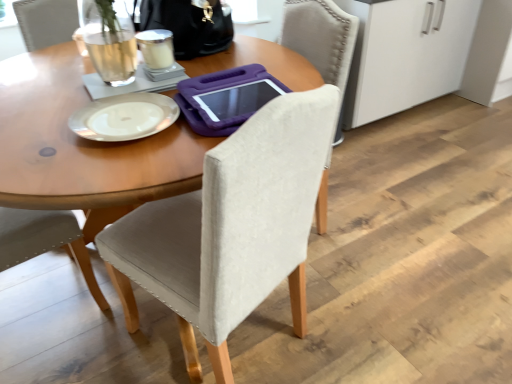
Question: From a real-world perspective, is beige fabric chair at center positioned under white frosted glass at upper center based on gravity?

Choices:
 (A) no
 (B) yes

Answer: (B)

Question: Does beige fabric chair at center have a lesser height compared to white frosted glass at upper center?

Choices:
 (A) yes
 (B) no

Answer: (B)

Question: From a real-world perspective, does beige fabric chair at center stand above white frosted glass at upper center?

Choices:
 (A) yes
 (B) no

Answer: (B)

Question: Does beige fabric chair at center come behind white frosted glass at upper center?

Choices:
 (A) no
 (B) yes

Answer: (A)

Question: From the image's perspective, would you say beige fabric chair at center is positioned over white frosted glass at upper center?

Choices:
 (A) no
 (B) yes

Answer: (A)

Question: Is the position of beige fabric chair at center less distant than that of white frosted glass at upper center?

Choices:
 (A) no
 (B) yes

Answer: (B)

Question: From a real-world perspective, is white frosted glass at upper center positioned under black leather handbag at upper center based on gravity?

Choices:
 (A) yes
 (B) no

Answer: (A)

Question: Is black leather handbag at upper center inside white frosted glass at upper center?

Choices:
 (A) no
 (B) yes

Answer: (A)

Question: Is white frosted glass at upper center taller than black leather handbag at upper center?

Choices:
 (A) no
 (B) yes

Answer: (A)

Question: Can you confirm if white frosted glass at upper center is thinner than black leather handbag at upper center?

Choices:
 (A) yes
 (B) no

Answer: (A)

Question: Is the depth of white frosted glass at upper center greater than that of black leather handbag at upper center?

Choices:
 (A) no
 (B) yes

Answer: (A)

Question: Considering the relative sizes of white frosted glass at upper center and black leather handbag at upper center in the image provided, is white frosted glass at upper center wider than black leather handbag at upper center?

Choices:
 (A) no
 (B) yes

Answer: (A)

Question: Is black leather handbag at upper center taller than white glossy plate at upper center?

Choices:
 (A) no
 (B) yes

Answer: (B)